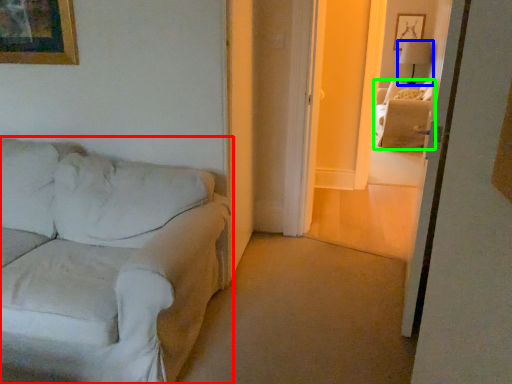
Question: Which object is the farthest from studio couch (highlighted by a red box)? Choose among these: lamp (highlighted by a blue box) or couch (highlighted by a green box).

Choices:
 (A) lamp
 (B) couch

Answer: (A)